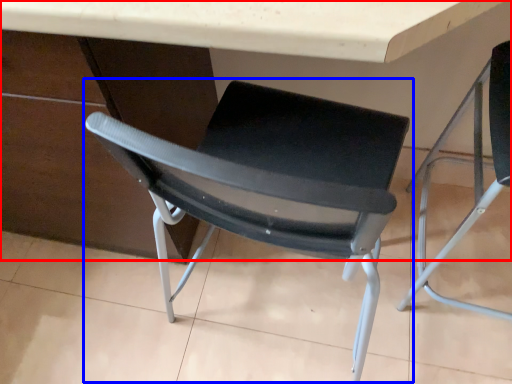
Question: Among these objects, which one is nearest to the camera, table (highlighted by a red box) or chair (highlighted by a blue box)?

Choices:
 (A) table
 (B) chair

Answer: (A)